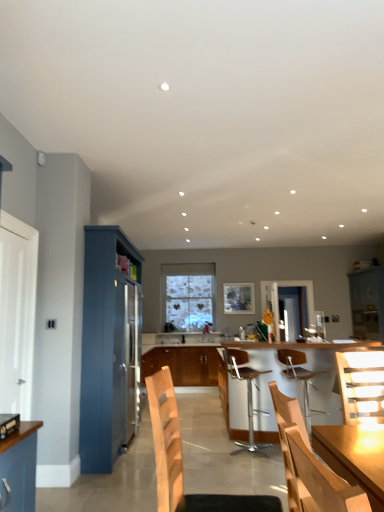
In order to face wooden cabinet at center, placed as the 2th cabinetry when sorted from left to right, should I rotate leftwards or rightwards?

Rotate your view right by about 0.078°.

You are a GUI agent. You are given a task and a screenshot of the screen. Output one action in this format:
    pyautogui.click(x=<x>, y=<y>)
    Task: Click on the transparent glass door at center, which appears as the 2th glass door when viewed from the front
    The width and height of the screenshot is (384, 512).
    Given the screenshot: What is the action you would take?
    pyautogui.click(x=293, y=309)

At what (x,y) coordinates should I click in order to perform the action: click on brushed metal toaster at left. Please return your answer as a coordinate pair (x, y). Looking at the image, I should click on (8, 424).

Image resolution: width=384 pixels, height=512 pixels. Find the location of `wooden bar at center`. wooden bar at center is located at coordinates (203, 379).

Image resolution: width=384 pixels, height=512 pixels. I want to click on glass window screen at center, so click(x=238, y=298).

Measure the distance between point (328, 413) and camera.

3.89 meters.

You are a GUI agent. You are given a task and a screenshot of the screen. Output one action in this format:
    pyautogui.click(x=<x>, y=<y>)
    Task: Click on the wooden cabinet at center, the 2th cabinetry viewed from the right
    The image size is (384, 512).
    Given the screenshot: What is the action you would take?
    pyautogui.click(x=184, y=364)

Can you tell me how much white glossy door at left, the 2th glass door positioned from the back, and wooden seat at center, which is the first chair from back to front, differ in facing direction?

The angle between the facing direction of white glossy door at left, the 2th glass door positioned from the back, and the facing direction of wooden seat at center, which is the first chair from back to front, is 39.8 degrees.

Are white glossy door at left, the first glass door from the left, and wooden seat at center, which is the first chair from back to front, beside each other?

No, white glossy door at left, the first glass door from the left, is not making contact with wooden seat at center, which is the first chair from back to front.

Is white glossy door at left, acting as the 1th glass door starting from the front, smaller than wooden seat at center, positioned as the fifth chair in front-to-back order?

Indeed, white glossy door at left, acting as the 1th glass door starting from the front, has a smaller size compared to wooden seat at center, positioned as the fifth chair in front-to-back order.

Which object is positioned more to the right, white glossy door at left, the first glass door from the left, or wooden seat at center, positioned as the fifth chair in front-to-back order?

wooden seat at center, positioned as the fifth chair in front-to-back order, is more to the right.

Can you confirm if blue painted cabinet at left, the 3th cabinetry from the back, is bigger than white textured stone window at center?

Correct, blue painted cabinet at left, the 3th cabinetry from the back, is larger in size than white textured stone window at center.

From the image's perspective, between blue painted cabinet at left, which is counted as the first cabinetry, starting from the left, and white textured stone window at center, who is located below?

white textured stone window at center appears lower in the image.

Could you tell me if wooden chair at center, which is the 4th chair from back to front, is facing transparent glass door at center, which appears as the 2th glass door when viewed from the front?

No.

Can you see wooden chair at center, which is counted as the 2th chair, starting from the front, touching transparent glass door at center, which is the 1th glass door in right-to-left order?

wooden chair at center, which is counted as the 2th chair, starting from the front, is not next to transparent glass door at center, which is the 1th glass door in right-to-left order, and they're not touching.

From a real-world perspective, which is physically below, wooden chair at center, which is counted as the 2th chair, starting from the front, or transparent glass door at center, which ranks as the 2th glass door in left-to-right order?

In real-world perspective, wooden chair at center, which is counted as the 2th chair, starting from the front, is lower.

Which of these two, wooden chair at center, which is the 4th chair from back to front, or transparent glass door at center, which is the 1th glass door in right-to-left order, is wider?

wooden chair at center, which is the 4th chair from back to front, is wider.

Does white glossy door at left, the first glass door from the left, have a lesser height compared to glass window screen at center?

Incorrect, the height of white glossy door at left, the first glass door from the left, does not fall short of that of glass window screen at center.

From a real-world perspective, relative to glass window screen at center, is white glossy door at left, the first glass door from the left, vertically above or below?

In terms of real-world spatial position, white glossy door at left, the first glass door from the left, is below glass window screen at center.

Which object is positioned more to the right, white glossy door at left, which is the 2th glass door from right to left, or glass window screen at center?

glass window screen at center.

Is white glossy door at left, acting as the 1th glass door starting from the front, not near wooden bar at center?

Indeed, white glossy door at left, acting as the 1th glass door starting from the front, is not near wooden bar at center.

From the image's perspective, relative to wooden bar at center, is white glossy door at left, the first glass door from the left, above or below?

Clearly, from the image's perspective, white glossy door at left, the first glass door from the left, is above wooden bar at center.

From a real-world perspective, relative to wooden bar at center, is white glossy door at left, the first glass door from the left, vertically above or below?

From a real-world perspective, white glossy door at left, the first glass door from the left, is physically above wooden bar at center.

Is white textured stone window at center oriented away from wooden chair at center, which is the 4th chair from back to front?

No, white textured stone window at center is not facing the opposite direction of wooden chair at center, which is the 4th chair from back to front.

How different are the orientations of white textured stone window at center and wooden chair at center, which is counted as the 2th chair, starting from the front, in degrees?

84.8 degrees separate the facing orientations of white textured stone window at center and wooden chair at center, which is counted as the 2th chair, starting from the front.

In terms of height, does white textured stone window at center look taller or shorter compared to wooden chair at center, which is counted as the 2th chair, starting from the front?

Clearly, white textured stone window at center is taller compared to wooden chair at center, which is counted as the 2th chair, starting from the front.

What are the coordinates of `window behind the wooden chair at center, which is the 4th chair from back to front` in the screenshot? It's located at (188, 295).

Locate an element on the screen. The height and width of the screenshot is (512, 384). chair that is the 4th object located below the wooden chair at center, the fifth chair from the back (from the image's perspective) is located at coordinates (248, 407).

From a real-world perspective, does wooden chair at center, the fifth chair from the back, stand above metallic silver bar stool at center, acting as the 2th chair starting from the back?

Yes, from a real-world perspective, wooden chair at center, the fifth chair from the back, is over metallic silver bar stool at center, acting as the 2th chair starting from the back

Considering the relative positions of wooden chair at center, the fifth chair from the back, and metallic silver bar stool at center, acting as the 2th chair starting from the back, in the image provided, is wooden chair at center, the fifth chair from the back, to the right of metallic silver bar stool at center, acting as the 2th chair starting from the back, from the viewer's perspective?

No.

Does point (332, 475) lie in front of point (248, 411)?

That is True.

In order to click on glass door that appears on the left of wooden seat at center, which is the first chair from back to front in this screenshot , I will do `click(17, 313)`.

Locate an element on the screen. The height and width of the screenshot is (512, 384). cabinetry above the white textured stone window at center (from the image's perspective) is located at coordinates (110, 347).

Estimate the real-world distances between objects in this image. Which object is further from transparent glass door at center, which ranks as the 2th glass door in left-to-right order, wooden chair at center, which is the 4th chair from back to front, or matte blue cabinet at right, the 2th cabinetry in the front-to-back sequence?

wooden chair at center, which is the 4th chair from back to front.

Based on their spatial positions, is wooden cabinet at center, the first cabinetry viewed from the back, or wooden seat at center, positioned as the fifth chair in front-to-back order, closer to wooden chair at right, acting as the 3th chair starting from the front?

Based on the image, wooden seat at center, positioned as the fifth chair in front-to-back order, appears to be nearer to wooden chair at right, acting as the 3th chair starting from the front.

Considering their positions, is wooden bar at center positioned closer to wooden chair at center, which is counted as the 2th chair, starting from the front, than brushed metal toaster at left?

Among the two, wooden bar at center is located nearer to wooden chair at center, which is counted as the 2th chair, starting from the front.

When comparing their distances from white textured stone window at center, does white glossy door at left, which is the 2th glass door from right to left, or metallic silver bar stool at center, acting as the 2th chair starting from the back, seem closer?

Based on the image, metallic silver bar stool at center, acting as the 2th chair starting from the back, appears to be nearer to white textured stone window at center.

From the image, which object appears to be farther from wooden chair at right, acting as the 3th chair starting from the front, wooden chair at center, which is counted as the 2th chair, starting from the front, or white glossy door at left, which is the 2th glass door from right to left?

white glossy door at left, which is the 2th glass door from right to left, is positioned further to the anchor wooden chair at right, acting as the 3th chair starting from the front.

Which object lies further to the anchor point wooden chair at right, which is the 3th chair in back-to-front order, blue painted cabinet at left, placed as the first cabinetry when sorted from front to back, or wooden chair at center, placed as the 1th chair when sorted from front to back?

wooden chair at center, placed as the 1th chair when sorted from front to back.

When comparing their distances from wooden chair at center, the fifth chair from the back, does white textured stone window at center or transparent glass door at center, which appears as the 2th glass door when viewed from the front, seem further?

transparent glass door at center, which appears as the 2th glass door when viewed from the front, lies further to wooden chair at center, the fifth chair from the back, than the other object.

Looking at the image, which one is located further to wooden chair at center, which is counted as the 2th chair, starting from the front, wooden chair at right, acting as the 3th chair starting from the front, or matte blue cabinet at right, which ranks as the 3th cabinetry in left-to-right order?

Based on the image, matte blue cabinet at right, which ranks as the 3th cabinetry in left-to-right order, appears to be further to wooden chair at center, which is counted as the 2th chair, starting from the front.

Find the location of a particular element. This screenshot has height=512, width=384. glass door situated between wooden cabinet at center, the 2th cabinetry viewed from the right, and matte blue cabinet at right, the 2th cabinetry in the front-to-back sequence, from left to right is located at coordinates (293, 309).

You are a GUI agent. You are given a task and a screenshot of the screen. Output one action in this format:
    pyautogui.click(x=<x>, y=<y>)
    Task: Click on the appliance positioned between wooden chair at center, the fifth chair from the back, and blue painted cabinet at left, the 3th cabinetry from the back, from near to far
    Image resolution: width=384 pixels, height=512 pixels.
    Given the screenshot: What is the action you would take?
    pyautogui.click(x=8, y=424)

Identify the location of countertop between white glossy door at left, acting as the 1th glass door starting from the front, and white textured stone window at center, along the z-axis. (203, 379).

The width and height of the screenshot is (384, 512). I want to click on chair between brushed metal toaster at left and wooden chair at center, the fifth chair from the back, in the horizontal direction, so click(182, 460).